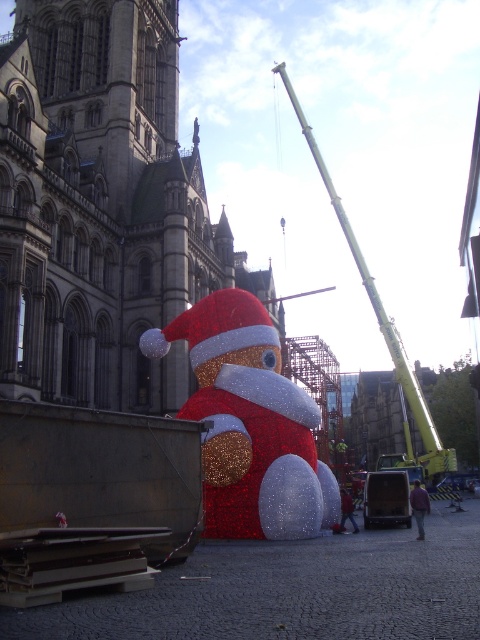
Question: Does stone tower at center appear under metallic yellow crane at center?

Choices:
 (A) no
 (B) yes

Answer: (A)

Question: Which of the following is the closest to the observer?

Choices:
 (A) (420, 417)
 (B) (406, 508)

Answer: (B)

Question: Which point appears closest to the camera in this image?

Choices:
 (A) (111, 84)
 (B) (388, 486)

Answer: (B)

Question: Does green metallic crane at upper right have a greater width compared to metallic yellow crane at center?

Choices:
 (A) yes
 (B) no

Answer: (A)

Question: From the image, what is the correct spatial relationship of stone tower at center in relation to metallic yellow crane at center?

Choices:
 (A) left
 (B) right

Answer: (A)

Question: Which point appears closest to the camera in this image?

Choices:
 (A) (266, 321)
 (B) (408, 380)
 (C) (392, 522)

Answer: (A)